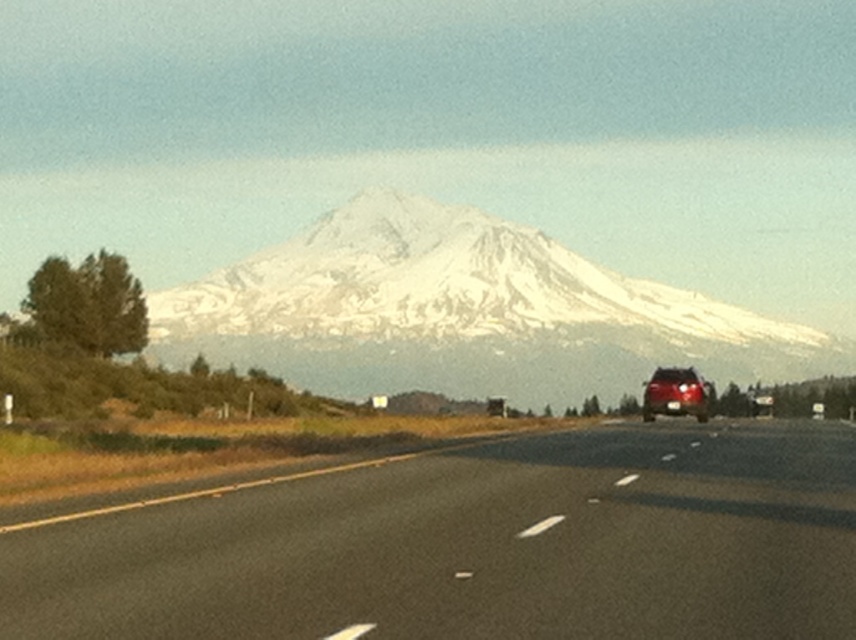
In the scene shown: You are standing at the viewpoint looking at the mountain scene. There are two points marked on the road, one at coordinates point (x=370, y=557) and the other at point (x=688, y=396). Which point is closer to you?

Point (x=370, y=557) is closer to the viewer than point (x=688, y=396).

Based on the photo, you are driving a car and want to overtake the satin red suv at center on the black asphalt road at center. The road is two lanes. Can you safely overtake the suv within the next 100 feet? Please explain your reasoning.

The distance between the black asphalt road at center and the satin red suv at center is 81.37 feet. Since the road is two lanes, you can safely overtake the satin red suv at center within the next 100 feet as the required distance is less than 100 feet.